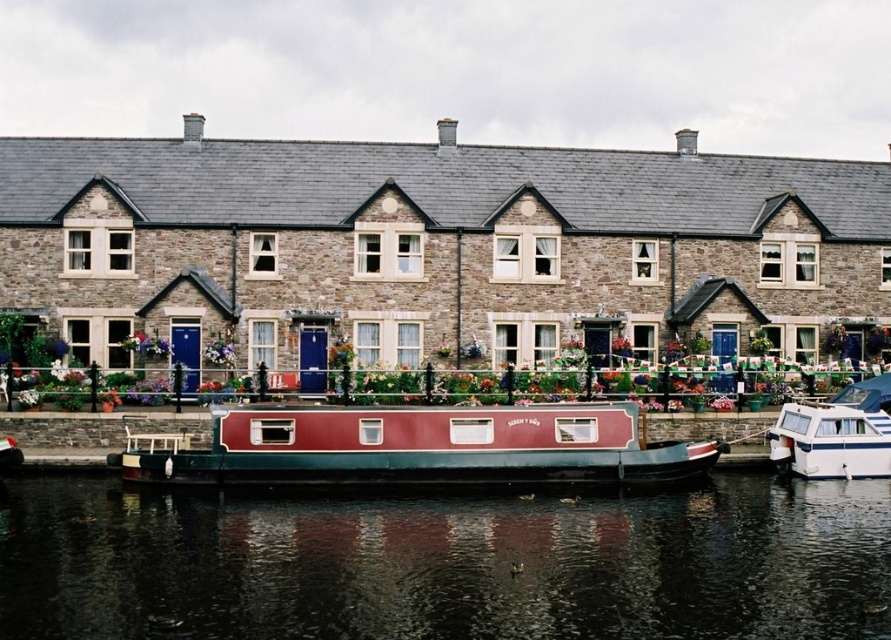
Question: Does smooth dark water at center have a smaller size compared to white glossy boat at lower right?

Choices:
 (A) no
 (B) yes

Answer: (A)

Question: Which point is farther to the camera?

Choices:
 (A) smooth dark water at center
 (B) white glossy boat at lower right

Answer: (B)

Question: Which object appears farthest from the camera in this image?

Choices:
 (A) white glossy boat at lower right
 (B) smooth dark water at center
 (C) maroon polished wood barge at center

Answer: (A)

Question: Can you confirm if maroon polished wood barge at center is positioned to the left of white glossy boat at lower right?

Choices:
 (A) yes
 (B) no

Answer: (A)

Question: Is smooth dark water at center smaller than maroon polished wood barge at center?

Choices:
 (A) no
 (B) yes

Answer: (A)

Question: Which of the following is the closest to the observer?

Choices:
 (A) (417, 413)
 (B) (883, 573)

Answer: (B)